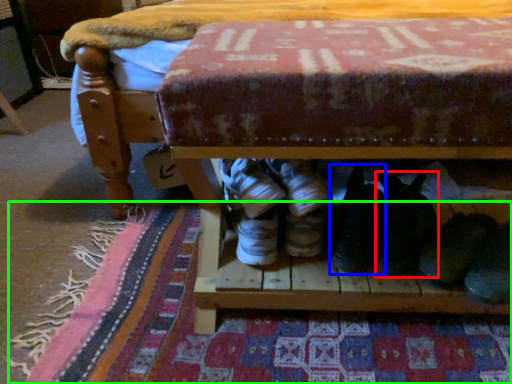
Question: Which object is positioned farthest from footwear (highlighted by a red box)? Select from footwear (highlighted by a blue box) and mat (highlighted by a green box).

Choices:
 (A) footwear
 (B) mat

Answer: (B)